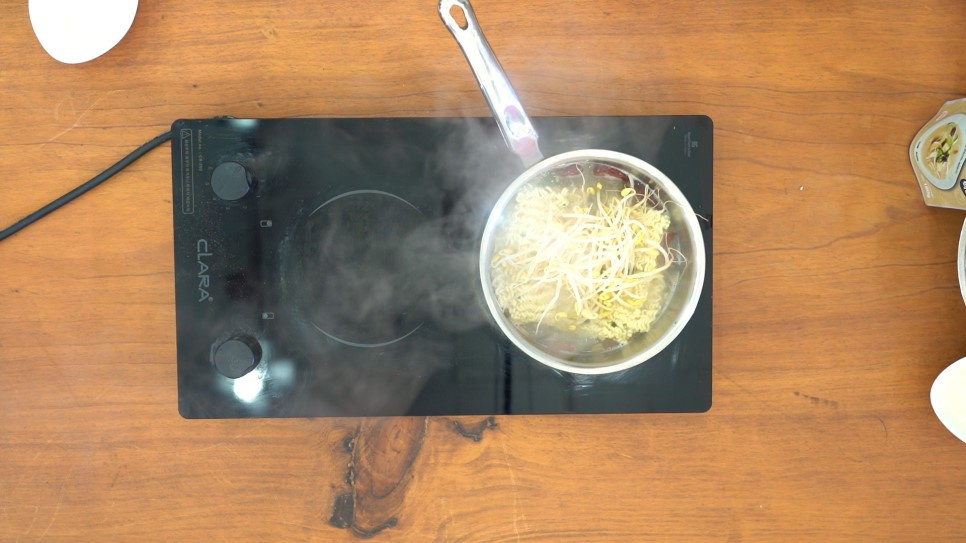
Where is `electric cord`? This screenshot has height=543, width=966. electric cord is located at coordinates (123, 163).